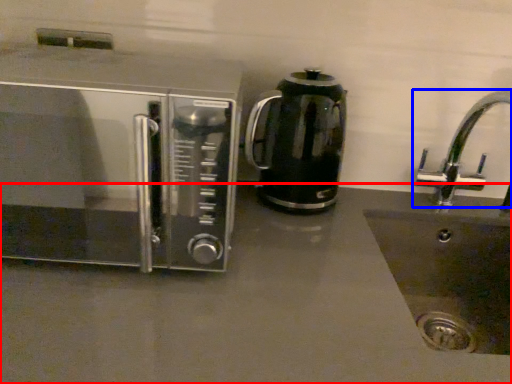
Question: Among these objects, which one is farthest to the camera, counter top (highlighted by a red box) or tap (highlighted by a blue box)?

Choices:
 (A) counter top
 (B) tap

Answer: (B)